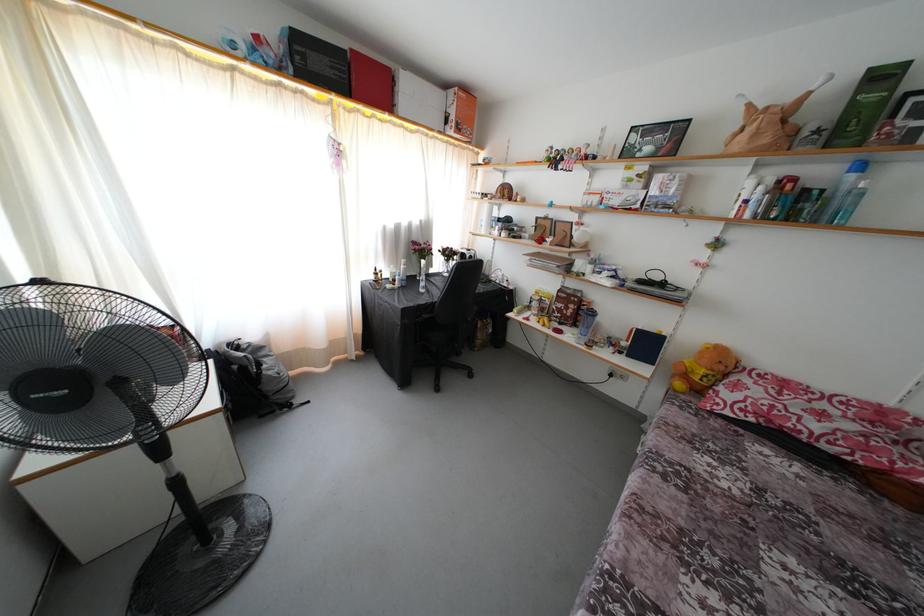
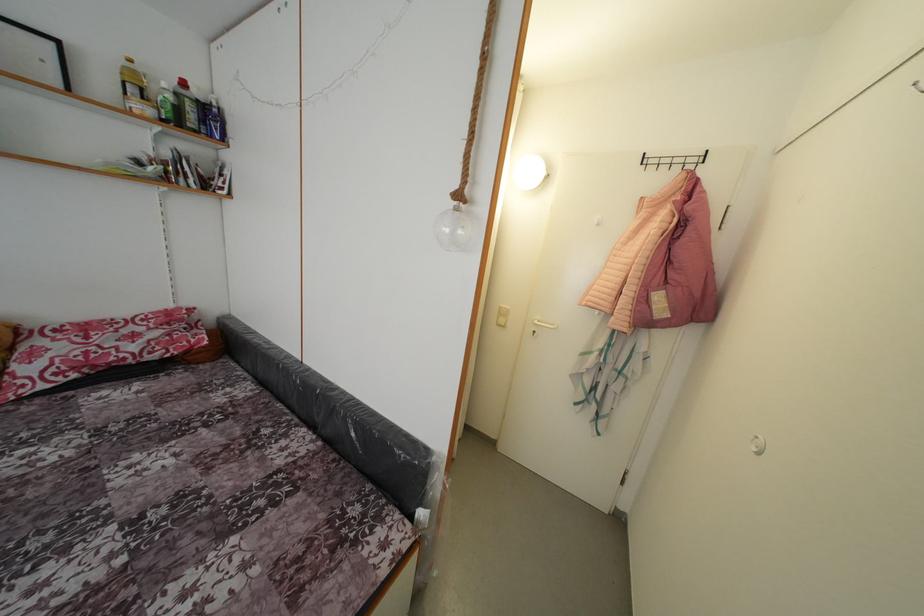
First-person continuous shooting, in which direction is the camera rotating?

The rotation direction of the camera is right-down.